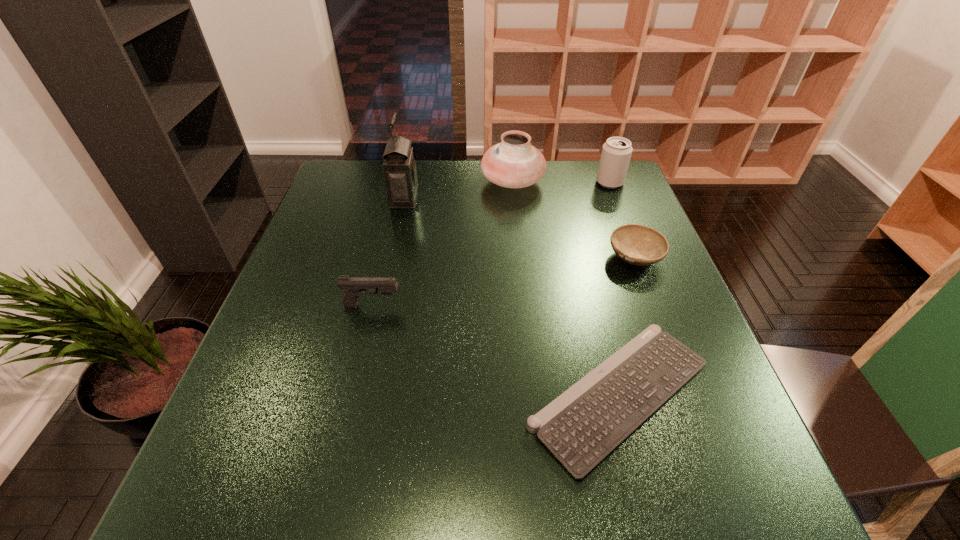
Locate an element on the screen. Image resolution: width=960 pixels, height=540 pixels. vacant space located on the front of the pottery is located at coordinates [518, 242].

Identify the location of free space located on the left of the can. (515, 183).

You are a GUI agent. You are given a task and a screenshot of the screen. Output one action in this format:
    pyautogui.click(x=<x>, y=<y>)
    Task: Click on the vacant space located 0.230m at the barrel of the third shortest object
    This screenshot has height=540, width=960.
    Given the screenshot: What is the action you would take?
    pyautogui.click(x=504, y=306)

You are a GUI agent. You are given a task and a screenshot of the screen. Output one action in this format:
    pyautogui.click(x=<x>, y=<y>)
    Task: Click on the vacant space located 0.280m on the left of the second shortest object
    
    Given the screenshot: What is the action you would take?
    pyautogui.click(x=495, y=258)

At what (x,y) coordinates should I click in order to perform the action: click on vacant space situated on the back of the nearest object. Please return your answer as a coordinate pair (x, y). The width and height of the screenshot is (960, 540). Looking at the image, I should click on (594, 294).

Where is `lantern that is at the far edge`? The height and width of the screenshot is (540, 960). lantern that is at the far edge is located at coordinates (x=399, y=167).

Locate an element on the screen. pottery present at the far edge is located at coordinates (514, 163).

Locate an element on the screen. The image size is (960, 540). can present at the far edge is located at coordinates (616, 153).

At what (x,y) coordinates should I click in order to perform the action: click on object that is at the near edge. Please return your answer as a coordinate pair (x, y). The width and height of the screenshot is (960, 540). Looking at the image, I should click on (582, 426).

Find the location of `object present at the left edge`. object present at the left edge is located at coordinates (354, 287).